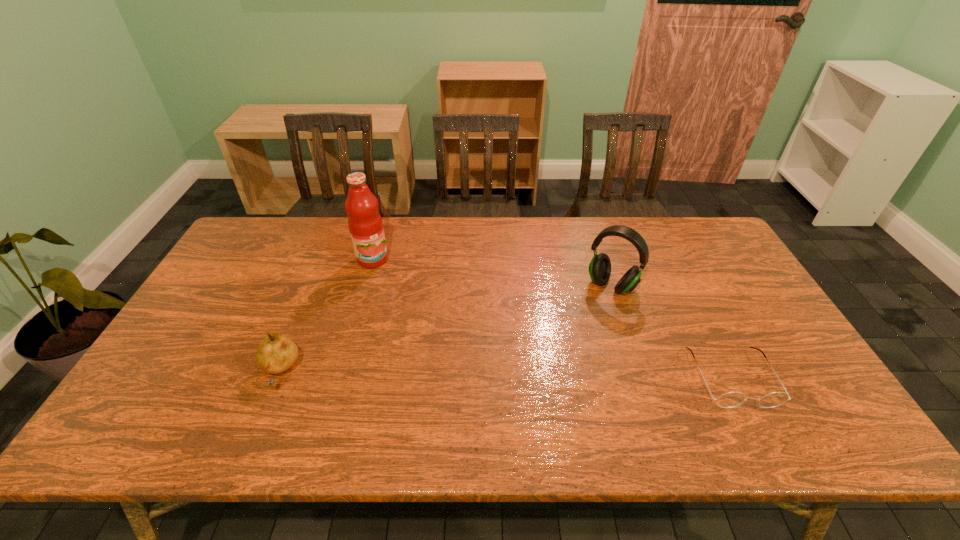
The image size is (960, 540). I want to click on free location located 0.270m on the front label of the tallest object, so click(415, 322).

Locate an element on the screen. vacant region located on the front label of the tallest object is located at coordinates (396, 294).

The width and height of the screenshot is (960, 540). What are the coordinates of `free location located on the ear cups of the second tallest object` in the screenshot? It's located at (543, 380).

The width and height of the screenshot is (960, 540). Find the location of `vacant space located 0.280m on the ear cups of the second tallest object`. vacant space located 0.280m on the ear cups of the second tallest object is located at coordinates (557, 361).

This screenshot has height=540, width=960. In order to click on vacant region located on the ear cups of the second tallest object in this screenshot , I will do `click(565, 349)`.

You are a GUI agent. You are given a task and a screenshot of the screen. Output one action in this format:
    pyautogui.click(x=<x>, y=<y>)
    Task: Click on the object that is at the far edge
    
    Given the screenshot: What is the action you would take?
    pyautogui.click(x=365, y=224)

The width and height of the screenshot is (960, 540). I want to click on pear present at the near edge, so click(275, 353).

Image resolution: width=960 pixels, height=540 pixels. Identify the location of spectacles at the near edge. (728, 400).

Find the location of a particular element. This screenshot has width=960, height=540. object located at the right edge is located at coordinates (728, 400).

The image size is (960, 540). I want to click on object present at the near right corner, so click(x=728, y=400).